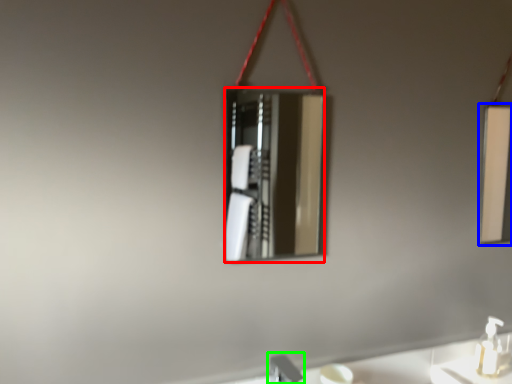
Question: Considering the real-world distances, which object is closest to mirror (highlighted by a red box)? mirror (highlighted by a blue box) or faucet (highlighted by a green box).

Choices:
 (A) mirror
 (B) faucet

Answer: (A)